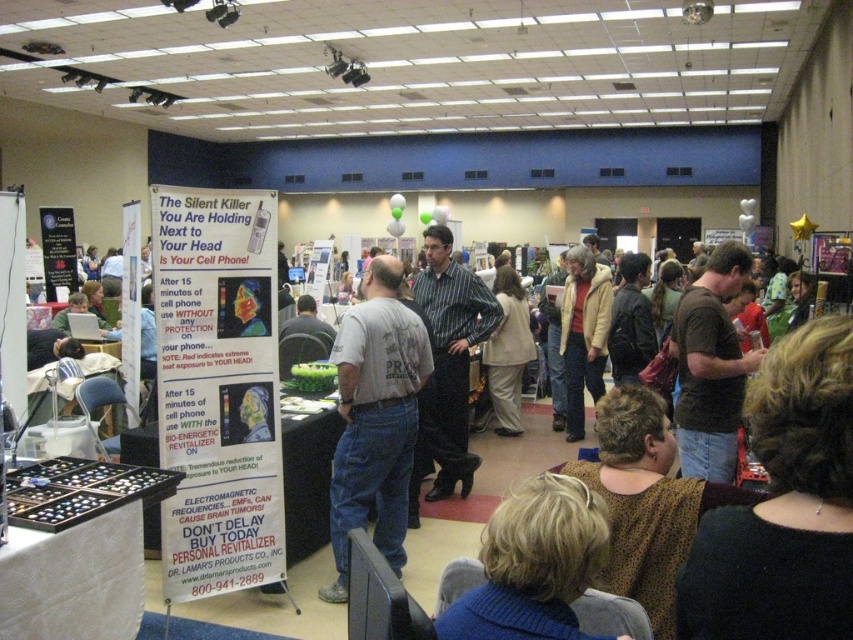
Which is above, gray cotton t-shirt at center or striped cotton shirt at center?

Positioned higher is striped cotton shirt at center.

Does gray cotton t-shirt at center appear over striped cotton shirt at center?

Actually, gray cotton t-shirt at center is below striped cotton shirt at center.

You are a GUI agent. You are given a task and a screenshot of the screen. Output one action in this format:
    pyautogui.click(x=<x>, y=<y>)
    Task: Click on the gray cotton t-shirt at center
    
    Given the screenshot: What is the action you would take?
    pyautogui.click(x=375, y=419)

Is point (479, 294) farther from camera compared to point (636, 273)?

No.

Is striped cotton shirt at center thinner than dark brown leather jacket at center?

No.

Is point (434, 324) in front of point (648, 312)?

Yes, point (434, 324) is closer to viewer.

I want to click on striped cotton shirt at center, so click(447, 365).

Which is above, dark brown t-shirt at center-right or dark brown leather jacket at center?

dark brown leather jacket at center is above.

Is point (718, 355) positioned after point (614, 333)?

No, (718, 355) is in front of (614, 333).

Between point (740, 276) and point (618, 298), which one is positioned in front?

Point (740, 276) is more forward.

You are a GUI agent. You are given a task and a screenshot of the screen. Output one action in this format:
    pyautogui.click(x=<x>, y=<y>)
    Task: Click on the dark brown t-shirt at center-right
    Image resolution: width=853 pixels, height=640 pixels.
    Given the screenshot: What is the action you would take?
    pyautogui.click(x=711, y=368)